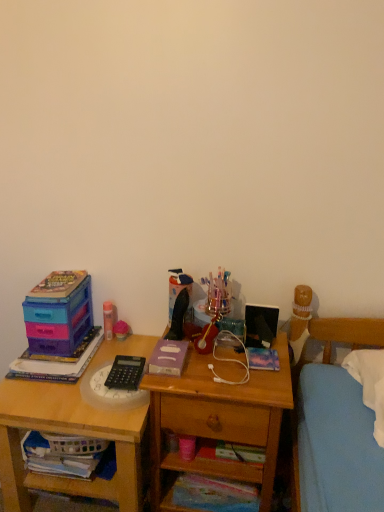
This screenshot has height=512, width=384. What are the coordinates of `free spot to the right of purple matte book at center, which is the fifth book from bottom to top` in the screenshot? It's located at pos(209,371).